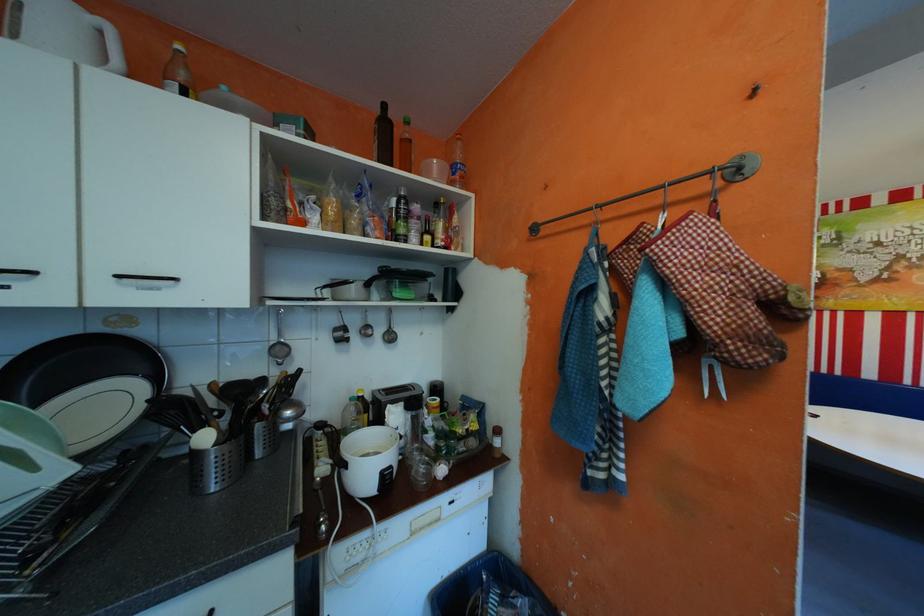
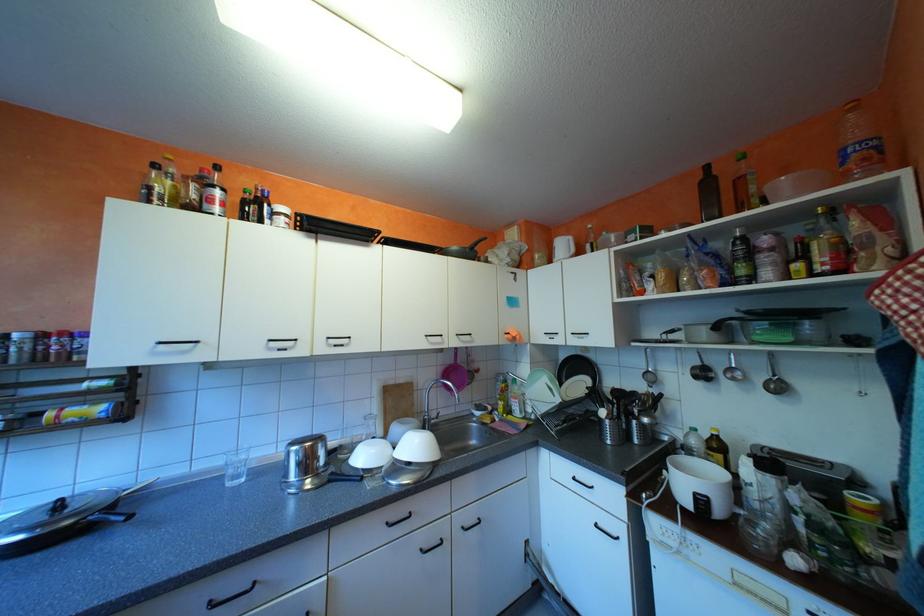
Where in the second image is the point corresponding to point (473, 176) from the first image?

(877, 159)